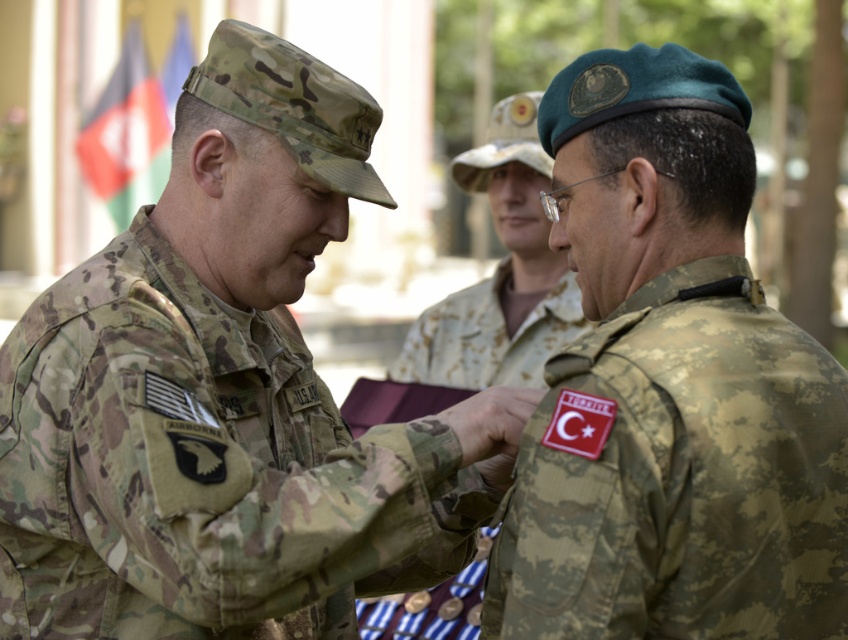
What is the 2D coordinate of the camo uniform at center?

The camo uniform at center is located at the 2D coordinate point of (226, 396).

You are a photographer at the ceremony. You need to capture a closeup shot of the camo uniform at center and the camouflage fabric beret at upper right in the same frame. Considering their sizes, which object should you focus on first to ensure both are in focus?

The camo uniform at center is larger in size than the camouflage fabric beret at upper right, so you should focus on the camo uniform at center first to ensure both are in focus.

What is located at the coordinates point (226, 396)?

The camo uniform at center is located at point (226, 396).